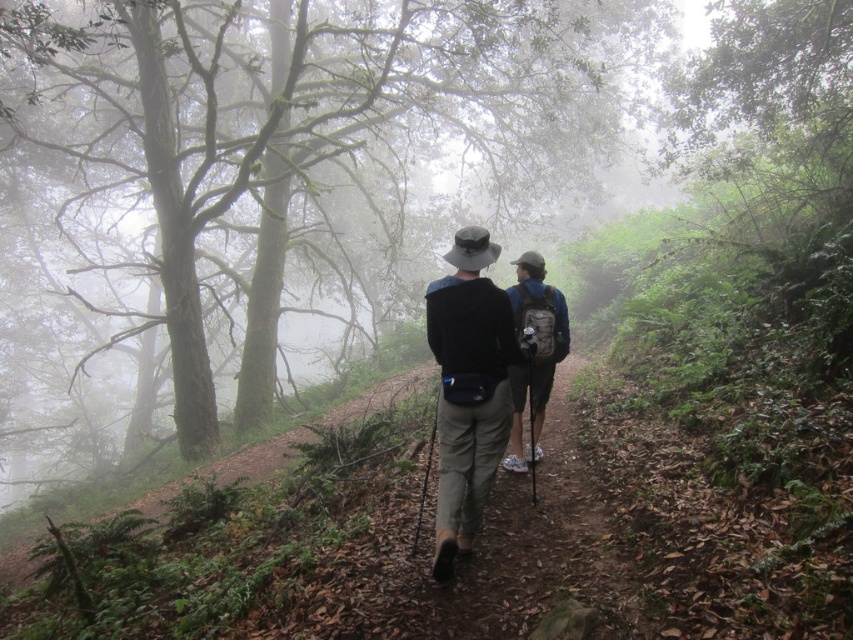
Which is more to the left, dark blue fabric backpack at center or blue fabric backpack at center?

dark blue fabric backpack at center

Is point (456, 323) closer to viewer compared to point (555, 307)?

Yes, it is.

Find the location of a particular element. The height and width of the screenshot is (640, 853). dark blue fabric backpack at center is located at coordinates (469, 388).